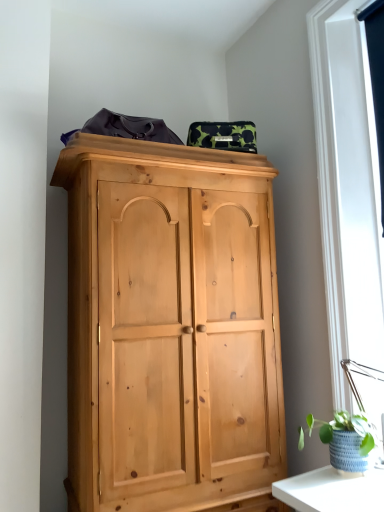
This screenshot has width=384, height=512. I want to click on green woven basket at lower right, so click(346, 440).

What do you see at coordinates (346, 440) in the screenshot? The image size is (384, 512). I see `green woven basket at lower right` at bounding box center [346, 440].

Measure the distance between point (345, 450) and camera.

Point (345, 450) is 4.30 feet from camera.

The height and width of the screenshot is (512, 384). What are the coordinates of `black fabric at upper right` in the screenshot? It's located at (376, 77).

The image size is (384, 512). Describe the element at coordinates (376, 77) in the screenshot. I see `black fabric at upper right` at that location.

Locate an element on the screen. The width and height of the screenshot is (384, 512). green woven basket at lower right is located at coordinates (346, 440).

Visually, is black fabric at upper right positioned to the left or to the right of green woven basket at lower right?

Clearly, black fabric at upper right is on the right of green woven basket at lower right in the image.

Considering their positions, is black fabric at upper right located in front of or behind green woven basket at lower right?

Visually, black fabric at upper right is located behind green woven basket at lower right.

Which is less distant, (x=380, y=90) or (x=349, y=418)?

Point (x=380, y=90) is farther from the camera than point (x=349, y=418).

From the image's perspective, is black fabric at upper right on green woven basket at lower right?

Yes, from the image's perspective, black fabric at upper right is above green woven basket at lower right.

From a real-world perspective, is black fabric at upper right above or below green woven basket at lower right?

black fabric at upper right is situated higher than green woven basket at lower right in the real world.

Does black fabric at upper right have a lesser width compared to green woven basket at lower right?

Indeed, black fabric at upper right has a lesser width compared to green woven basket at lower right.

In the scene shown: Between black fabric at upper right and green woven basket at lower right, which one has less height?

green woven basket at lower right is shorter.

Who is bigger, black fabric at upper right or green woven basket at lower right?

Bigger between the two is black fabric at upper right.

Is black fabric at upper right not within green woven basket at lower right?

Absolutely, black fabric at upper right is external to green woven basket at lower right.

Is black fabric at upper right not close to green woven basket at lower right?

black fabric at upper right is far away from green woven basket at lower right.

Is black fabric at upper right facing towards green woven basket at lower right?

No, black fabric at upper right is not aimed at green woven basket at lower right.

Image resolution: width=384 pixels, height=512 pixels. In the image, there is a black fabric at upper right. Find the location of `houseplant below it (from a real-world perspective)`. houseplant below it (from a real-world perspective) is located at coordinates (346, 440).

Can you confirm if green woven basket at lower right is positioned to the right of black fabric at upper right?

No.

Which object is more forward, green woven basket at lower right or black fabric at upper right?

green woven basket at lower right is in front.

Which is in front, point (348, 415) or point (378, 50)?

The point (348, 415) is in front.

From the image's perspective, is green woven basket at lower right on top of black fabric at upper right?

Actually, green woven basket at lower right appears below black fabric at upper right in the image.

From a real-world perspective, is green woven basket at lower right above or below black fabric at upper right?

Clearly, from a real-world perspective, green woven basket at lower right is below black fabric at upper right.

Is green woven basket at lower right wider than black fabric at upper right?

Yes.

Can you confirm if green woven basket at lower right is shorter than black fabric at upper right?

Correct, green woven basket at lower right is not as tall as black fabric at upper right.

Between green woven basket at lower right and black fabric at upper right, which one has larger size?

With larger size is black fabric at upper right.

Looking at this image, which is correct: green woven basket at lower right is inside black fabric at upper right, or outside of it?

green woven basket at lower right is not enclosed by black fabric at upper right.

Based on the photo, is green woven basket at lower right not close to black fabric at upper right?

Yes, green woven basket at lower right and black fabric at upper right are quite far apart.

Is green woven basket at lower right turned away from black fabric at upper right?

No, green woven basket at lower right is not facing the opposite direction of black fabric at upper right.

Based on the photo, can you tell me how much green woven basket at lower right and black fabric at upper right differ in facing direction?

They differ by 0.407 degrees in their facing directions.

I want to click on houseplant in front of the black fabric at upper right, so click(346, 440).

Locate an element on the screen. Image resolution: width=384 pixels, height=512 pixels. houseplant in front of the black fabric at upper right is located at coordinates (346, 440).

Locate an element on the screen. window screen above the green woven basket at lower right (from the image's perspective) is located at coordinates (376, 77).